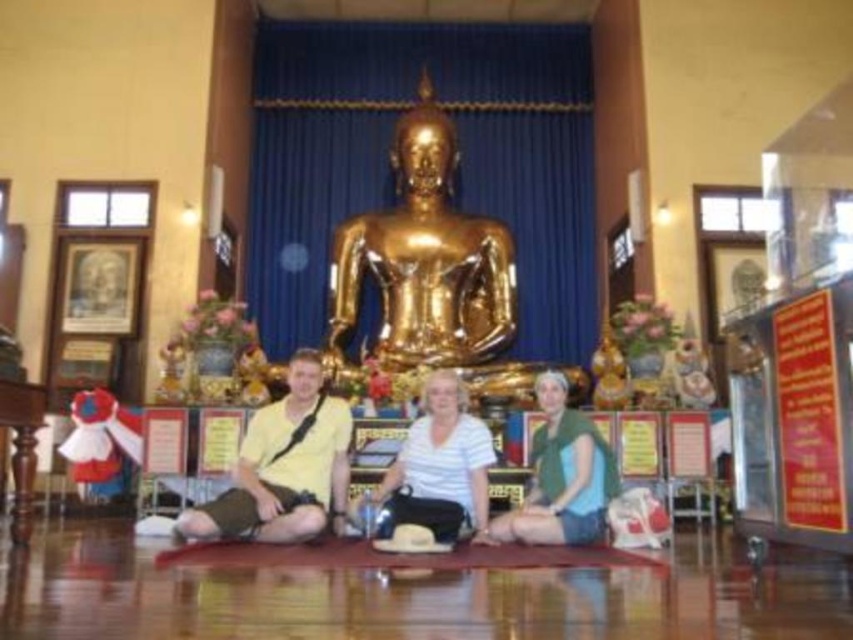
Image resolution: width=853 pixels, height=640 pixels. What do you see at coordinates (440, 468) in the screenshot?
I see `white matte shirt at center` at bounding box center [440, 468].

Between point (451, 436) and point (561, 538), which one is positioned in front?

Positioned in front is point (561, 538).

You are a GUI agent. You are given a task and a screenshot of the screen. Output one action in this format:
    pyautogui.click(x=<x>, y=<y>)
    Task: Click on the white matte shirt at center
    This screenshot has height=640, width=853.
    Given the screenshot: What is the action you would take?
    pyautogui.click(x=440, y=468)

Who is more forward, [335,470] or [561,408]?

Point [335,470] is more forward.

Who is taller, yellow matte shirt at center or green matte shirt at center?

yellow matte shirt at center is taller.

Is point (276, 458) in front of point (610, 497)?

No.

What are the coordinates of `yellow matte shirt at center` in the screenshot? It's located at (283, 467).

Is gold shiny statue at center above yellow matte shirt at center?

Yes, gold shiny statue at center is above yellow matte shirt at center.

Between point (354, 294) and point (247, 483), which one is positioned in front?

Positioned in front is point (247, 483).

At what (x,y) coordinates should I click in order to perform the action: click on gold shiny statue at center. Please return your answer as a coordinate pair (x, y). The image size is (853, 640). Looking at the image, I should click on (424, 260).